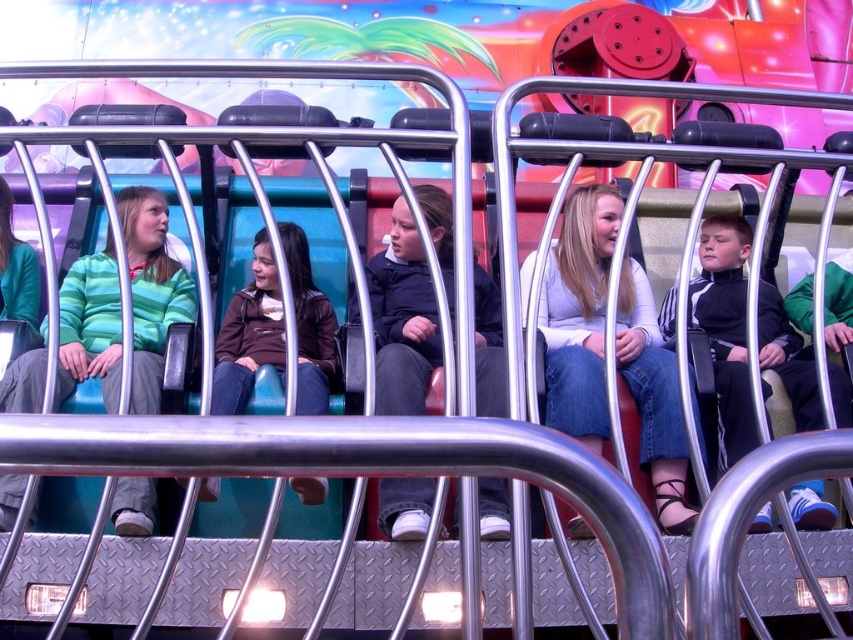
Question: Which object appears closest to the camera in this image?

Choices:
 (A) dark blue jacket at center
 (B) brown leather jacket at center
 (C) green striped sweater at left
 (D) black matte jacket at right

Answer: (B)

Question: Which of the following is the farthest from the observer?

Choices:
 (A) dark blue jacket at center
 (B) black matte jacket at right
 (C) denim jeans at center

Answer: (C)

Question: Can you confirm if green striped sweater at left is smaller than brown leather jacket at center?

Choices:
 (A) yes
 (B) no

Answer: (B)

Question: Is the position of dark blue jacket at center more distant than that of black matte jacket at right?

Choices:
 (A) no
 (B) yes

Answer: (A)

Question: Can you confirm if dark blue jacket at center is positioned to the right of brown leather jacket at center?

Choices:
 (A) no
 (B) yes

Answer: (B)

Question: Which of the following is the closest to the observer?

Choices:
 (A) (73, 369)
 (B) (297, 477)

Answer: (B)